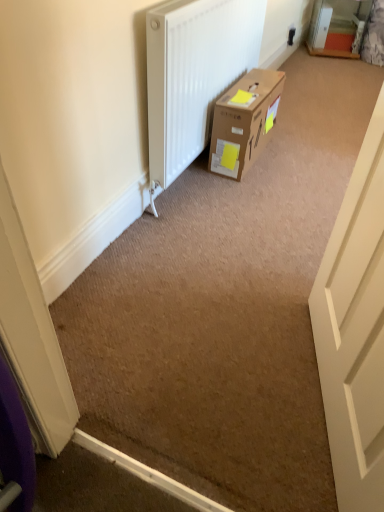
This screenshot has height=512, width=384. I want to click on vacant region to the right of brown cardboard box at center, so click(302, 156).